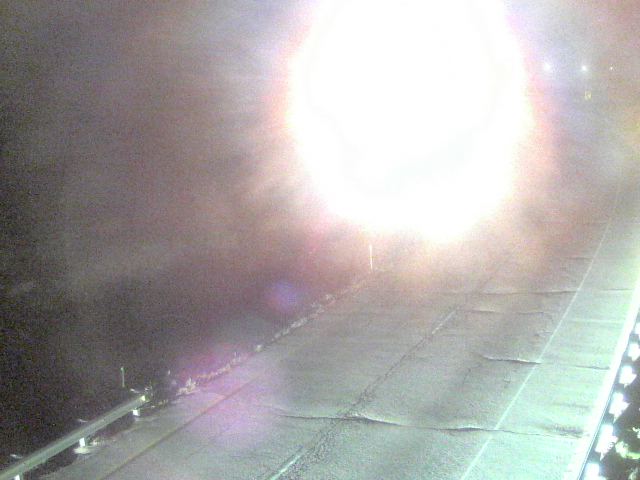
Find the location of a particular element. bottom of light is located at coordinates (416, 256).